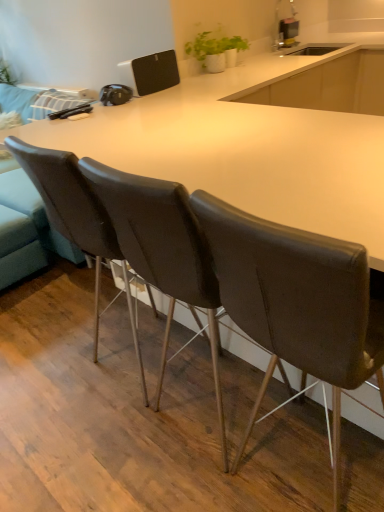
Identify the location of white matte pot at upper center. The image size is (384, 512). (213, 45).

What do you see at coordinates (288, 32) in the screenshot? I see `metallic silver toaster at upper center` at bounding box center [288, 32].

Locate an element on the screen. Image resolution: width=384 pixels, height=512 pixels. metallic silver toaster at upper center is located at coordinates (288, 32).

Measure the distance between brown leather chair at center, which is counted as the first chair, starting from the right, and camera.

The distance of brown leather chair at center, which is counted as the first chair, starting from the right, from camera is 24.30 inches.

How much space does brown leather chair at center, which is counted as the first chair, starting from the right, occupy vertically?

1.09 meters.

Where is `leather at left, which appears as the 1th chair when viewed from the left`? leather at left, which appears as the 1th chair when viewed from the left is located at coordinates (76, 217).

Where is `leather at center, the 2th chair in the left-to-right sequence`? leather at center, the 2th chair in the left-to-right sequence is located at coordinates (163, 251).

Is point (213, 44) in front of point (361, 251)?

No, it is behind (361, 251).

How many degrees apart are the facing directions of white matte pot at upper center and brown leather chair at center, which is counted as the first chair, starting from the right?

The facing directions of white matte pot at upper center and brown leather chair at center, which is counted as the first chair, starting from the right, are 87.9 degrees apart.

From the image's perspective, is white matte pot at upper center above or below brown leather chair at center, arranged as the 3th chair when viewed from the left?

From the image's perspective, white matte pot at upper center appears above brown leather chair at center, arranged as the 3th chair when viewed from the left.

Could you tell me if white matte pot at upper center is turned towards brown leather chair at center, arranged as the 3th chair when viewed from the left?

No, white matte pot at upper center is not oriented towards brown leather chair at center, arranged as the 3th chair when viewed from the left.

Who is taller, metallic silver toaster at upper center or leather at center, the 2th chair in the left-to-right sequence?

leather at center, the 2th chair in the left-to-right sequence, is taller.

How distant is metallic silver toaster at upper center from leather at center, the 2th chair in the left-to-right sequence?

metallic silver toaster at upper center is 2.67 meters away from leather at center, the 2th chair in the left-to-right sequence.

Is metallic silver toaster at upper center positioned with its back to leather at center, the 2th chair positioned from the right?

A: No, leather at center, the 2th chair positioned from the right, is not at the back of metallic silver toaster at upper center.

From a real-world perspective, who is located higher, metallic silver toaster at upper center or leather at center, the 2th chair in the left-to-right sequence?

metallic silver toaster at upper center, from a real-world perspective.

Are metallic silver toaster at upper center and leather at left, the 3th chair when ordered from right to left, far apart?

Indeed, metallic silver toaster at upper center is not near leather at left, the 3th chair when ordered from right to left.

Which of these two, metallic silver toaster at upper center or leather at left, the 3th chair when ordered from right to left, is smaller?

metallic silver toaster at upper center.

Which of these two, metallic silver toaster at upper center or leather at left, the 3th chair when ordered from right to left, stands taller?

leather at left, the 3th chair when ordered from right to left, is taller.

Which object is positioned more to the left, metallic silver toaster at upper center or leather at left, the 3th chair when ordered from right to left?

leather at left, the 3th chair when ordered from right to left, is more to the left.

Which of these two, leather at center, the 2th chair positioned from the right, or leather at left, which appears as the 1th chair when viewed from the left, is bigger?

Bigger between the two is leather at left, which appears as the 1th chair when viewed from the left.

How far apart are leather at center, the 2th chair in the left-to-right sequence, and leather at left, which appears as the 1th chair when viewed from the left?

A distance of 24.03 centimeters exists between leather at center, the 2th chair in the left-to-right sequence, and leather at left, which appears as the 1th chair when viewed from the left.

How many degrees apart are the facing directions of leather at center, the 2th chair in the left-to-right sequence, and leather at left, which appears as the 1th chair when viewed from the left?

0.358 degrees separate the facing orientations of leather at center, the 2th chair in the left-to-right sequence, and leather at left, which appears as the 1th chair when viewed from the left.

Is leather at center, the 2th chair in the left-to-right sequence, aimed at leather at left, the 3th chair when ordered from right to left?

No, leather at center, the 2th chair in the left-to-right sequence, is not oriented towards leather at left, the 3th chair when ordered from right to left.

Based on the photo, would you consider leather at center, the 2th chair positioned from the right, to be distant from metallic silver toaster at upper center?

Yes.

There is a metallic silver toaster at upper center. Where is `the 2nd chair below it (from the image's perspective)`? the 2nd chair below it (from the image's perspective) is located at coordinates (163, 251).

Is leather at center, the 2th chair in the left-to-right sequence, looking in the opposite direction of metallic silver toaster at upper center?

No, leather at center, the 2th chair in the left-to-right sequence, is not facing the opposite direction of metallic silver toaster at upper center.

Based on the photo, in terms of width, does brown leather chair at center, which is counted as the first chair, starting from the right, look wider or thinner when compared to white matte pot at upper center?

In the image, brown leather chair at center, which is counted as the first chair, starting from the right, appears to be wider than white matte pot at upper center.

Can we say brown leather chair at center, arranged as the 3th chair when viewed from the left, lies outside white matte pot at upper center?

brown leather chair at center, arranged as the 3th chair when viewed from the left, is positioned outside white matte pot at upper center.

From the picture: Who is more distant, brown leather chair at center, arranged as the 3th chair when viewed from the left, or white matte pot at upper center?

Positioned behind is white matte pot at upper center.

From the picture: Is brown leather chair at center, which is counted as the first chair, starting from the right, not close to white matte pot at upper center?

brown leather chair at center, which is counted as the first chair, starting from the right, is far away from white matte pot at upper center.

Does white matte pot at upper center turn towards metallic silver toaster at upper center?

No, white matte pot at upper center does not turn towards metallic silver toaster at upper center.

Find the location of a particular element. kitchen appliance that appears below the white matte pot at upper center (from a real-world perspective) is located at coordinates (288, 32).

Is white matte pot at upper center positioned beyond the bounds of metallic silver toaster at upper center?

Yes, white matte pot at upper center is not within metallic silver toaster at upper center.

Considering the relative positions of white matte pot at upper center and metallic silver toaster at upper center in the image provided, is white matte pot at upper center to the left or to the right of metallic silver toaster at upper center?

From the image, it's evident that white matte pot at upper center is to the left of metallic silver toaster at upper center.

Where is `chair on the right of white matte pot at upper center`? This screenshot has width=384, height=512. chair on the right of white matte pot at upper center is located at coordinates (296, 302).

The width and height of the screenshot is (384, 512). I want to click on kitchen appliance behind the leather at center, the 2th chair positioned from the right, so click(x=288, y=32).

Considering their positions, is metallic silver toaster at upper center positioned further to brown leather chair at center, which is counted as the first chair, starting from the right, than white matte pot at upper center?

Among the two, metallic silver toaster at upper center is located further to brown leather chair at center, which is counted as the first chair, starting from the right.

Estimate the real-world distances between objects in this image. Which object is closer to metallic silver toaster at upper center, white matte pot at upper center or leather at left, the 3th chair when ordered from right to left?

The object closer to metallic silver toaster at upper center is white matte pot at upper center.

From the image, which object appears to be farther from metallic silver toaster at upper center, leather at center, the 2th chair in the left-to-right sequence, or white matte pot at upper center?

leather at center, the 2th chair in the left-to-right sequence.

Considering their positions, is brown leather chair at center, arranged as the 3th chair when viewed from the left, positioned further to leather at left, the 3th chair when ordered from right to left, than leather at center, the 2th chair in the left-to-right sequence?

The object further to leather at left, the 3th chair when ordered from right to left, is brown leather chair at center, arranged as the 3th chair when viewed from the left.

Looking at the image, which one is located closer to white matte pot at upper center, leather at center, the 2th chair in the left-to-right sequence, or brown leather chair at center, which is counted as the first chair, starting from the right?

Based on the image, leather at center, the 2th chair in the left-to-right sequence, appears to be nearer to white matte pot at upper center.

From the image, which object appears to be farther from white matte pot at upper center, leather at left, the 3th chair when ordered from right to left, or metallic silver toaster at upper center?

Among the two, leather at left, the 3th chair when ordered from right to left, is located further to white matte pot at upper center.

Estimate the real-world distances between objects in this image. Which object is further from leather at center, the 2th chair positioned from the right, brown leather chair at center, arranged as the 3th chair when viewed from the left, or white matte pot at upper center?

white matte pot at upper center is further to leather at center, the 2th chair positioned from the right.

Which object lies nearer to the anchor point brown leather chair at center, arranged as the 3th chair when viewed from the left, leather at left, the 3th chair when ordered from right to left, or white matte pot at upper center?

The object closer to brown leather chair at center, arranged as the 3th chair when viewed from the left, is leather at left, the 3th chair when ordered from right to left.

You are a GUI agent. You are given a task and a screenshot of the screen. Output one action in this format:
    pyautogui.click(x=<x>, y=<y>)
    Task: Click on the houseplant between brown leather chair at center, which is counted as the first chair, starting from the right, and metallic silver toaster at upper center, along the z-axis
    
    Given the screenshot: What is the action you would take?
    pyautogui.click(x=213, y=45)

Locate an element on the screen. This screenshot has height=512, width=384. houseplant between leather at left, which appears as the 1th chair when viewed from the left, and metallic silver toaster at upper center from front to back is located at coordinates (213, 45).

I want to click on houseplant between leather at center, the 2th chair in the left-to-right sequence, and metallic silver toaster at upper center in the front-back direction, so click(x=213, y=45).

Find the location of a particular element. chair between leather at center, the 2th chair positioned from the right, and metallic silver toaster at upper center, along the z-axis is located at coordinates (76, 217).